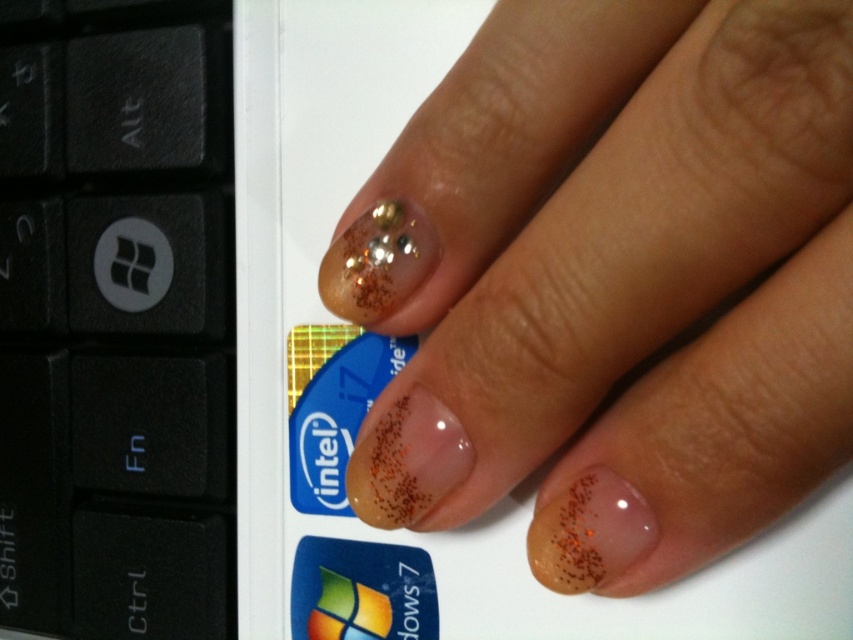
You are a virtual assistant trying to determine the location of the clear gel nails at center in the image. Based on the coordinate system where the bottom left corner is the origin, what are their coordinates?

The clear gel nails at center are located at coordinates point (619,280).

You are a virtual assistant analyzing a hand image. The hand has clear gel nails at center. There is a point at coordinates [619,280]. According to the image description, where is this point located?

The point at coordinates [619,280] is located on the clear gel nails at center.